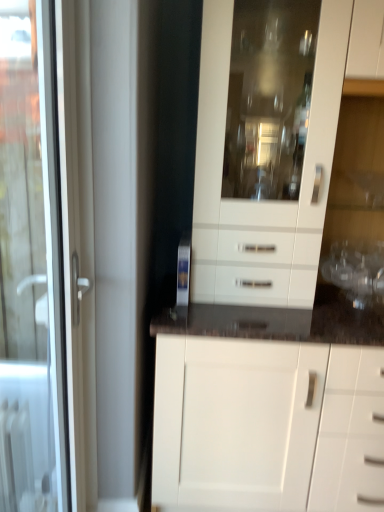
Question: Is white glossy cabinet at center oriented towards white glossy door at left?

Choices:
 (A) yes
 (B) no

Answer: (B)

Question: Can you confirm if white glossy cabinet at center is wider than white glossy door at left?

Choices:
 (A) no
 (B) yes

Answer: (B)

Question: Can you confirm if white glossy cabinet at center is positioned to the left of white glossy door at left?

Choices:
 (A) no
 (B) yes

Answer: (A)

Question: Considering the relative sizes of white glossy cabinet at center and white glossy door at left in the image provided, is white glossy cabinet at center shorter than white glossy door at left?

Choices:
 (A) no
 (B) yes

Answer: (A)

Question: Can you confirm if white glossy cabinet at center is bigger than white glossy door at left?

Choices:
 (A) no
 (B) yes

Answer: (B)

Question: Does white glossy cabinet at center touch white glossy door at left?

Choices:
 (A) yes
 (B) no

Answer: (B)

Question: Does white glossy door at left have a larger size compared to white glossy cabinet at center?

Choices:
 (A) yes
 (B) no

Answer: (B)

Question: Is white glossy cabinet at center a part of white glossy door at left?

Choices:
 (A) yes
 (B) no

Answer: (B)

Question: Is white glossy door at left at the right side of white glossy cabinet at center?

Choices:
 (A) no
 (B) yes

Answer: (A)

Question: From a real-world perspective, is white glossy door at left below white glossy cabinet at center?

Choices:
 (A) no
 (B) yes

Answer: (B)

Question: Is white glossy door at left smaller than white glossy cabinet at center?

Choices:
 (A) yes
 (B) no

Answer: (A)

Question: From the image's perspective, does white glossy door at left appear lower than white glossy cabinet at center?

Choices:
 (A) no
 (B) yes

Answer: (B)

Question: Would you say white glossy cabinet at center is to the left or to the right of white glossy door at left in the picture?

Choices:
 (A) right
 (B) left

Answer: (A)